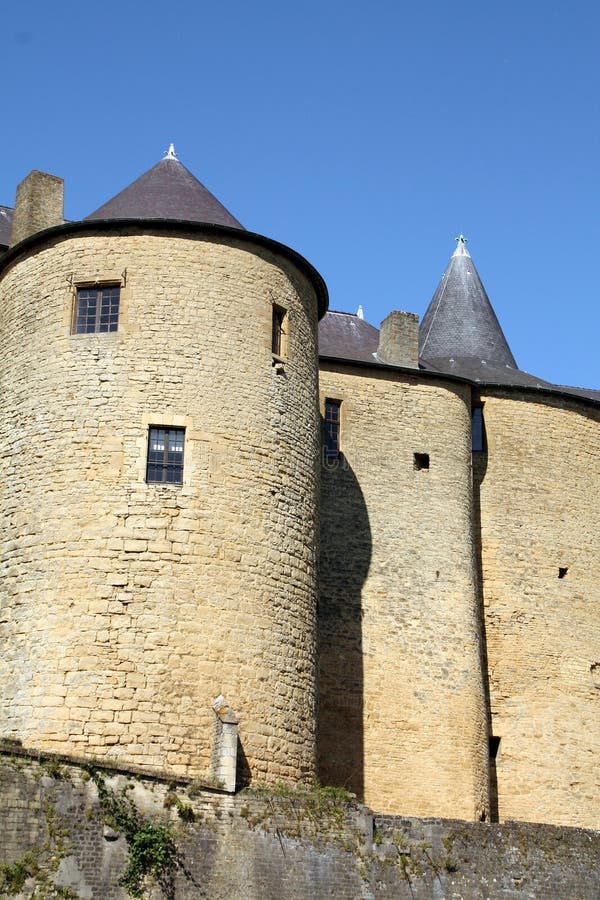
Identify the location of window. This screenshot has width=600, height=900. (160, 460), (97, 310), (279, 329), (336, 430), (421, 466), (480, 437).